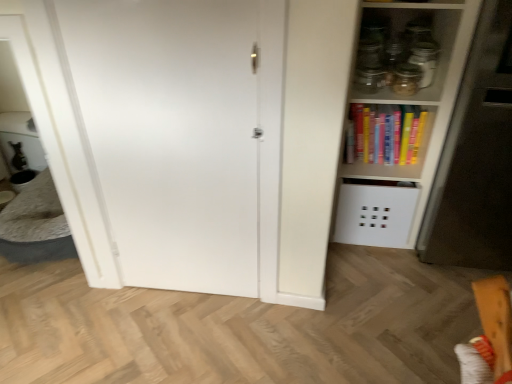
Where is `white matte fridge at right`? The width and height of the screenshot is (512, 384). white matte fridge at right is located at coordinates coord(476,158).

At what (x,y) coordinates should I click in order to perform the action: click on white matte door at center. Please return your answer as a coordinate pair (x, y). Looking at the image, I should click on (170, 135).

Describe the element at coordinates (406, 79) in the screenshot. I see `transparent glass jar at upper right, the second glass jar positioned from the right` at that location.

At what (x,y) coordinates should I click in order to perform the action: click on transparent glass jar at upper right, which appears as the first glass jar when viewed from the left. Please return your answer as a coordinate pair (x, y). This screenshot has height=384, width=512. Looking at the image, I should click on (406, 79).

Identify the location of transparent glass jar at upper right, the second glass jar in the left-to-right sequence. (425, 61).

In order to click on white glossy table at left in this screenshot , I will do pyautogui.click(x=36, y=225).

This screenshot has height=384, width=512. Identify the location of white matte fridge at right. (476, 158).

Is transparent glass jar at upper right, the second glass jar positioned from the right, turned away from white matte door at center?

No, transparent glass jar at upper right, the second glass jar positioned from the right,'s orientation is not away from white matte door at center.

Is transparent glass jar at upper right, the second glass jar positioned from the right, in front of or behind white matte door at center in the image?

transparent glass jar at upper right, the second glass jar positioned from the right, is positioned farther from the viewer than white matte door at center.

Is transparent glass jar at upper right, the second glass jar positioned from the right, with white matte door at center?

No.

You are a GUI agent. You are given a task and a screenshot of the screen. Output one action in this format:
    pyautogui.click(x=<x>, y=<y>)
    Task: Click on the 1st glass jar directly above the white matte door at center (from a real-world perspective)
    The image size is (512, 384).
    Given the screenshot: What is the action you would take?
    pyautogui.click(x=406, y=79)

From a real-world perspective, relative to transparent glass jar at upper right, which appears as the first glass jar when viewed from the left, is white glossy table at left vertically above or below?

In terms of real-world spatial position, white glossy table at left is below transparent glass jar at upper right, which appears as the first glass jar when viewed from the left.

Which is more to the right, white glossy table at left or transparent glass jar at upper right, the second glass jar positioned from the right?

From the viewer's perspective, transparent glass jar at upper right, the second glass jar positioned from the right, appears more on the right side.

Is white glossy table at left aimed at transparent glass jar at upper right, which appears as the first glass jar when viewed from the left?

No.

Can transparent glass jar at upper right, which appears as the first glass jar when viewed from the left, be found inside white glossy table at left?

No, transparent glass jar at upper right, which appears as the first glass jar when viewed from the left, is not inside white glossy table at left.

In the scene shown: Does transparent glass jar at upper right, the first glass jar in the right-to-left sequence, appear on the left side of white matte door at center?

No.

From a real-world perspective, is transparent glass jar at upper right, the second glass jar in the left-to-right sequence, located higher than white matte door at center?

Correct, in the physical world, transparent glass jar at upper right, the second glass jar in the left-to-right sequence, is higher than white matte door at center.

From the picture: Between transparent glass jar at upper right, the second glass jar in the left-to-right sequence, and white matte door at center, which one is positioned in front?

white matte door at center.

From the picture: Which of these two, transparent glass jar at upper right, the second glass jar in the left-to-right sequence, or white matte door at center, is wider?

With larger width is transparent glass jar at upper right, the second glass jar in the left-to-right sequence.

Is white matte door at center thinner than hardcover books at upper right?

Indeed, white matte door at center has a lesser width compared to hardcover books at upper right.

What are the coordinates of `door lying on the left of hardcover books at upper right` in the screenshot? It's located at click(170, 135).

Is hardcover books at upper right at the back of white matte door at center?

No, hardcover books at upper right is not at the back of white matte door at center.

Between white matte door at center and hardcover books at upper right, which one is positioned behind?

hardcover books at upper right is further away from the camera.

Is there a large distance between white matte door at center and transparent glass jar at upper right, which appears as the first glass jar when viewed from the left?

No, white matte door at center is not far away from transparent glass jar at upper right, which appears as the first glass jar when viewed from the left.

Does white matte door at center turn towards transparent glass jar at upper right, the second glass jar positioned from the right?

No, white matte door at center is not turned towards transparent glass jar at upper right, the second glass jar positioned from the right.

From the image's perspective, would you say white matte door at center is shown under transparent glass jar at upper right, which appears as the first glass jar when viewed from the left?

Yes, from the image's perspective, white matte door at center is below transparent glass jar at upper right, which appears as the first glass jar when viewed from the left.

From a real-world perspective, is white matte door at center above or below transparent glass jar at upper right, the second glass jar positioned from the right?

In terms of real-world spatial position, white matte door at center is below transparent glass jar at upper right, the second glass jar positioned from the right.

Which is correct: white matte fridge at right is inside transparent glass jar at upper right, the second glass jar positioned from the right, or outside of it?

white matte fridge at right is not inside transparent glass jar at upper right, the second glass jar positioned from the right, it's outside.

Which is farther, (508, 73) or (392, 81)?

The point (392, 81) is more distant.

From the image's perspective, who appears lower, white matte fridge at right or transparent glass jar at upper right, which appears as the first glass jar when viewed from the left?

white matte fridge at right, from the image's perspective.

Identify the location of the 1st glass jar positioned above the white matte fridge at right (from a real-world perspective). The image size is (512, 384). tap(406, 79).

From the image's perspective, is white glossy table at left under hardcover books at upper right?

Indeed, from the image's perspective, white glossy table at left is shown beneath hardcover books at upper right.

How many degrees apart are the facing directions of white glossy table at left and hardcover books at upper right?

white glossy table at left and hardcover books at upper right are facing 0.618 degrees away from each other.

Is white glossy table at left wider than hardcover books at upper right?

Yes, white glossy table at left is wider than hardcover books at upper right.

Which object is further away from the camera, white glossy table at left or hardcover books at upper right?

Positioned behind is white glossy table at left.

Where is `the 1st glass jar counting from the right of the white matte door at center`? The image size is (512, 384). the 1st glass jar counting from the right of the white matte door at center is located at coordinates (406, 79).

Where is `table that appears below the transparent glass jar at upper right, which appears as the first glass jar when viewed from the left (from the image's perspective)`? Image resolution: width=512 pixels, height=384 pixels. table that appears below the transparent glass jar at upper right, which appears as the first glass jar when viewed from the left (from the image's perspective) is located at coordinates (36, 225).

From the image, which object appears to be nearer to white matte fridge at right, transparent glass jar at upper right, the second glass jar in the left-to-right sequence, or hardcover books at upper right?

hardcover books at upper right.

Which object lies nearer to the anchor point white glossy table at left, transparent glass jar at upper right, the second glass jar positioned from the right, or hardcover books at upper right?

hardcover books at upper right is positioned closer to the anchor white glossy table at left.

When comparing their distances from transparent glass jar at upper right, the first glass jar in the right-to-left sequence, does white matte fridge at right or hardcover books at upper right seem further?

Among the two, white matte fridge at right is located further to transparent glass jar at upper right, the first glass jar in the right-to-left sequence.

Which object lies nearer to the anchor point white matte fridge at right, white glossy table at left or white matte door at center?

white matte door at center lies closer to white matte fridge at right than the other object.

Estimate the real-world distances between objects in this image. Which object is further from transparent glass jar at upper right, which appears as the first glass jar when viewed from the left, hardcover books at upper right or white matte door at center?

white matte door at center lies further to transparent glass jar at upper right, which appears as the first glass jar when viewed from the left, than the other object.

Considering their positions, is transparent glass jar at upper right, the first glass jar in the right-to-left sequence, positioned closer to hardcover books at upper right than white matte fridge at right?

transparent glass jar at upper right, the first glass jar in the right-to-left sequence, lies closer to hardcover books at upper right than the other object.

Looking at the image, which one is located further to transparent glass jar at upper right, the first glass jar in the right-to-left sequence, transparent glass jar at upper right, which appears as the first glass jar when viewed from the left, or white glossy table at left?

Among the two, white glossy table at left is located further to transparent glass jar at upper right, the first glass jar in the right-to-left sequence.

In the scene shown: When comparing their distances from transparent glass jar at upper right, the second glass jar in the left-to-right sequence, does transparent glass jar at upper right, the second glass jar positioned from the right, or white matte fridge at right seem further?

white matte fridge at right is positioned further to the anchor transparent glass jar at upper right, the second glass jar in the left-to-right sequence.

Identify the location of book located between white matte door at center and transparent glass jar at upper right, which appears as the first glass jar when viewed from the left, in the left-right direction. This screenshot has height=384, width=512. (385, 134).

Locate an element on the screen. The height and width of the screenshot is (384, 512). glass jar between transparent glass jar at upper right, the second glass jar positioned from the right, and white matte fridge at right from left to right is located at coordinates (425, 61).

This screenshot has width=512, height=384. I want to click on door situated between white glossy table at left and transparent glass jar at upper right, which appears as the first glass jar when viewed from the left, from left to right, so (170, 135).

Locate an element on the screen. The image size is (512, 384). door located between white glossy table at left and hardcover books at upper right in the left-right direction is located at coordinates (170, 135).